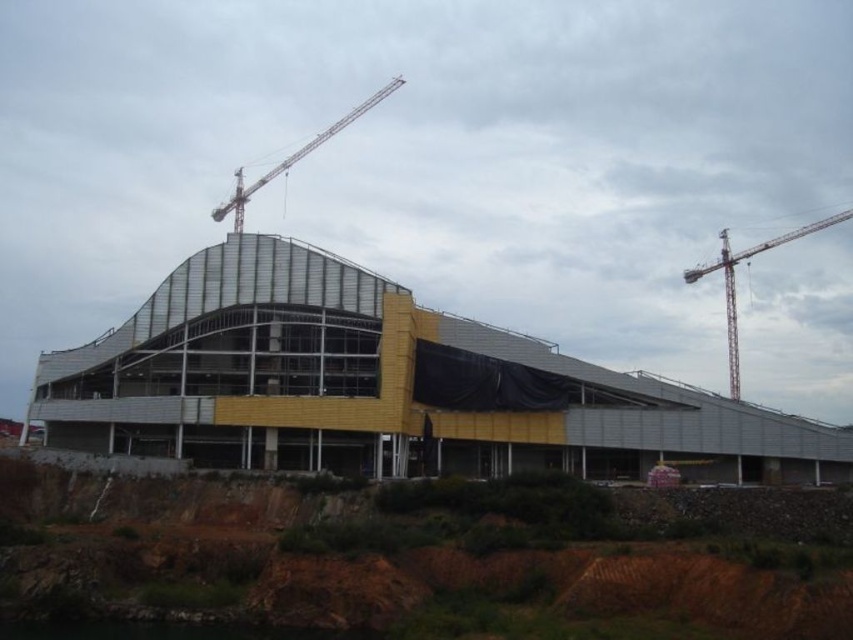
Question: Among these objects, which one is farthest from the camera?

Choices:
 (A) metallic red crane at upper right
 (B) metallic glass building at center
 (C) metallic gray crane at upper center

Answer: (A)

Question: Does metallic glass building at center have a smaller size compared to metallic gray crane at upper center?

Choices:
 (A) no
 (B) yes

Answer: (B)

Question: Among these points, which one is farthest from the camera?

Choices:
 (A) (685, 428)
 (B) (287, 164)

Answer: (B)

Question: Which is farther from the metallic red crane at upper right?

Choices:
 (A) metallic gray crane at upper center
 (B) metallic glass building at center

Answer: (A)

Question: Does metallic red crane at upper right lie in front of metallic gray crane at upper center?

Choices:
 (A) yes
 (B) no

Answer: (B)

Question: Does metallic glass building at center have a lesser width compared to metallic gray crane at upper center?

Choices:
 (A) no
 (B) yes

Answer: (A)